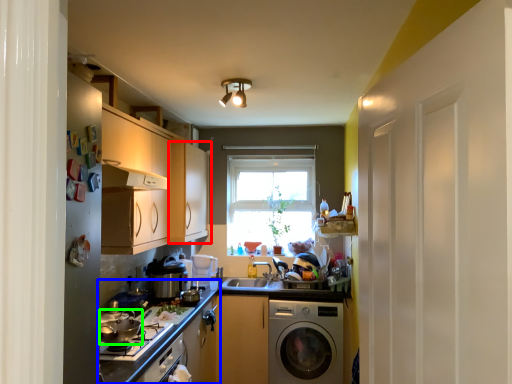
Question: Based on their relative distances, which object is farther from cabinetry (highlighted by a red box)? Choose from countertop (highlighted by a blue box) and appliance (highlighted by a green box).

Choices:
 (A) countertop
 (B) appliance

Answer: (B)